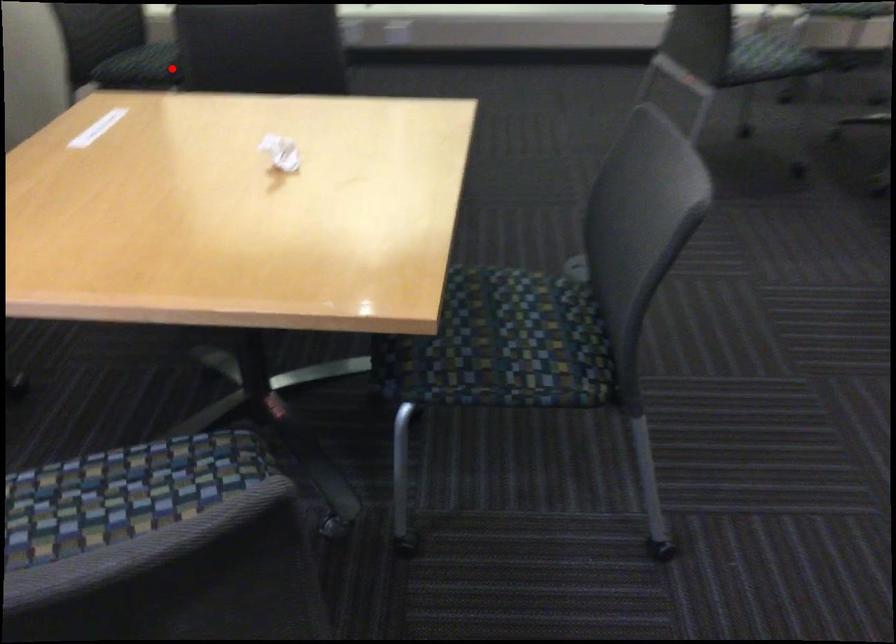
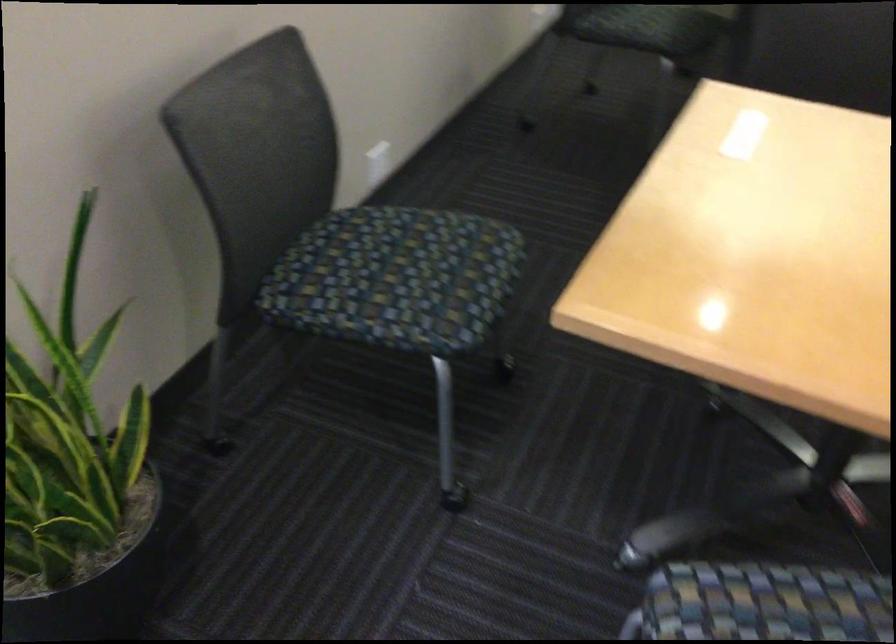
Question: I am providing you with two images of the same scene from different viewpoints. In image1, a red point is highlighted. Considering the same 3D point in image2, which of the following is correct?

Choices:
 (A) It is closer
 (B) It is farther

Answer: (A)